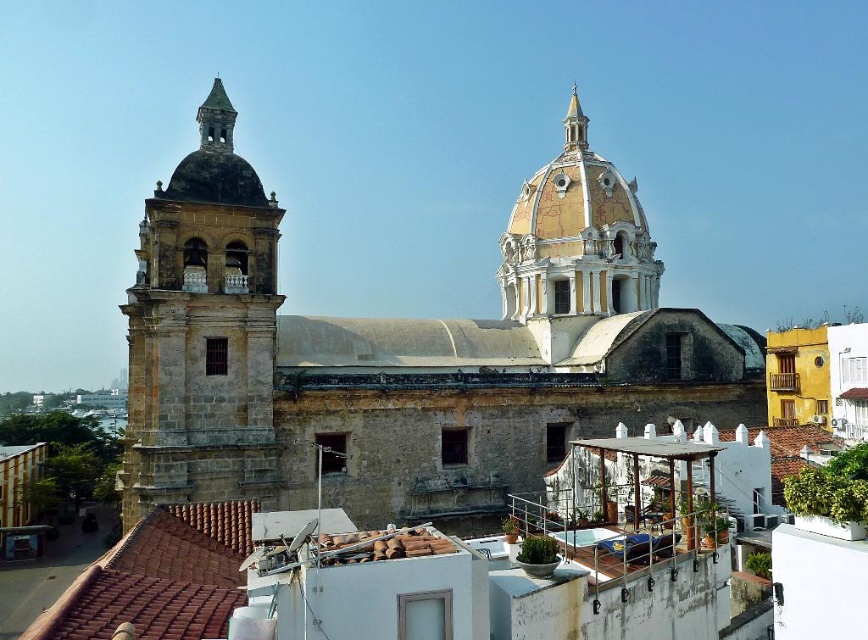
You are an architect analyzing the spatial relationship between the brown stone bell tower at left and the gold textured spire at upper center in the image. Based on their positions, which structure is located below the other?

The brown stone bell tower at left is positioned under the gold textured spire at upper center, meaning the bell tower is below the spire.

You are a tourist standing at the base of the bell tower on the left. You notice a point marked at coordinates (576, 243) in the image. Which architectural feature does this point correspond to?

The point corresponds to the yellowish marble dome at upper center.